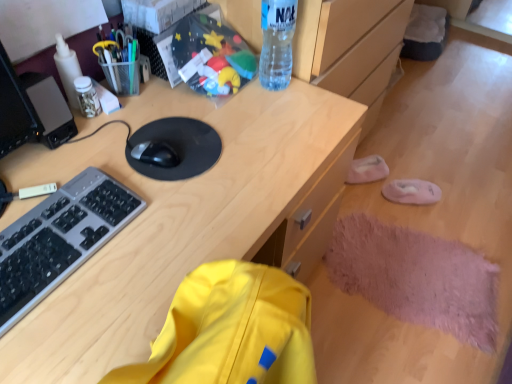
At what (x,y) coordinates should I click in order to perform the action: click on vacant area on the back side of black matte mousepad at center. Please return your answer as a coordinate pair (x, y). The image size is (512, 384). Looking at the image, I should click on pyautogui.click(x=196, y=98).